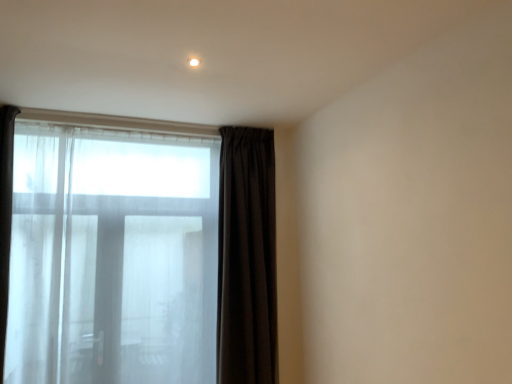
Question: From a real-world perspective, is dark matte curtain at center physically below white glossy light at upper center?

Choices:
 (A) no
 (B) yes

Answer: (B)

Question: Is dark matte curtain at center facing away from white glossy light at upper center?

Choices:
 (A) yes
 (B) no

Answer: (B)

Question: From the image's perspective, is dark matte curtain at center on top of white glossy light at upper center?

Choices:
 (A) yes
 (B) no

Answer: (B)

Question: Is dark matte curtain at center positioned behind white glossy light at upper center?

Choices:
 (A) yes
 (B) no

Answer: (A)

Question: Is dark matte curtain at center outside of white glossy light at upper center?

Choices:
 (A) yes
 (B) no

Answer: (A)

Question: Is transparent fabric bay window at left situated inside white glossy light at upper center or outside?

Choices:
 (A) outside
 (B) inside

Answer: (A)

Question: Considering their positions, is transparent fabric bay window at left located in front of or behind white glossy light at upper center?

Choices:
 (A) behind
 (B) front

Answer: (A)

Question: From a real-world perspective, is transparent fabric bay window at left physically located above or below white glossy light at upper center?

Choices:
 (A) above
 (B) below

Answer: (B)

Question: Based on their sizes in the image, would you say transparent fabric bay window at left is bigger or smaller than white glossy light at upper center?

Choices:
 (A) small
 (B) big

Answer: (B)

Question: Looking at the image, does dark matte curtain at center seem bigger or smaller compared to transparent fabric bay window at left?

Choices:
 (A) big
 (B) small

Answer: (B)

Question: Would you say dark matte curtain at center is inside or outside transparent fabric bay window at left?

Choices:
 (A) inside
 (B) outside

Answer: (B)

Question: From their relative heights in the image, would you say dark matte curtain at center is taller or shorter than transparent fabric bay window at left?

Choices:
 (A) tall
 (B) short

Answer: (A)

Question: Is dark matte curtain at center wider or thinner than transparent fabric bay window at left?

Choices:
 (A) thin
 (B) wide

Answer: (B)

Question: Is transparent fabric bay window at left bigger or smaller than dark matte curtain at center?

Choices:
 (A) small
 (B) big

Answer: (B)

Question: Considering the positions of transparent fabric bay window at left and dark matte curtain at center in the image, is transparent fabric bay window at left taller or shorter than dark matte curtain at center?

Choices:
 (A) tall
 (B) short

Answer: (B)